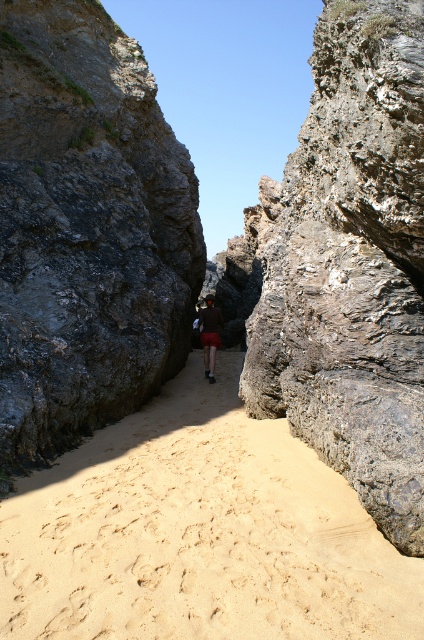
You are standing at the entrance of the pathway and want to reach the exit. Based on the image, where is the beige sandy path at center located in terms of its 2D coordinates?

The beige sandy path at center is located at the 2D coordinates point (198,532).

You are a hiker carrying a heavy backpack and want to walk along the beige sandy path at center. Based on the scene, will the rough gray rock at center block your path?

The beige sandy path at center is located below the rough gray rock at center, so the rock is above the path and would not block your way. You can safely walk along the beige sandy path at center.